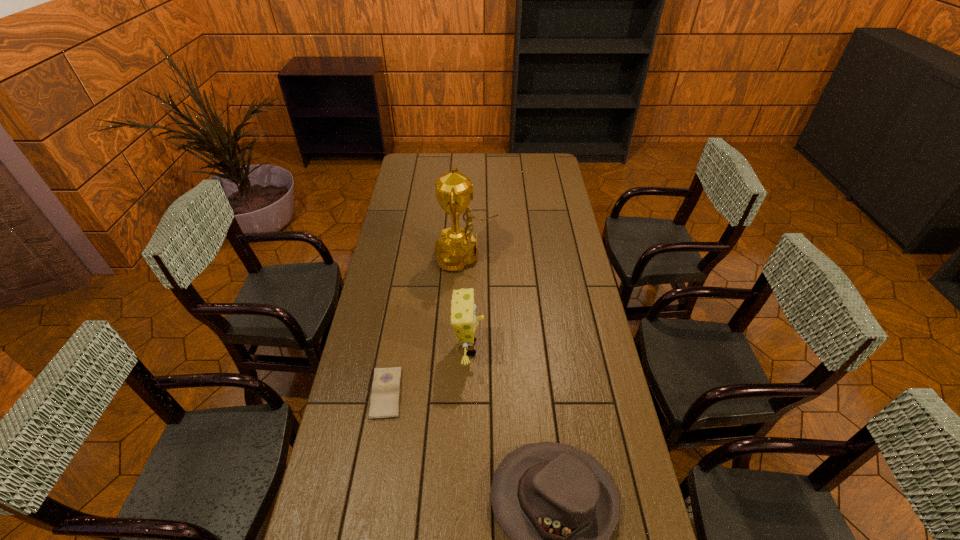
The image size is (960, 540). Identify the location of the tallest object. (457, 248).

In order to click on the farthest object in this screenshot , I will do `click(457, 248)`.

This screenshot has width=960, height=540. Find the location of `the third shortest object`. the third shortest object is located at coordinates (463, 309).

The width and height of the screenshot is (960, 540). What are the coordinates of `the leftmost object` in the screenshot? It's located at (384, 404).

The image size is (960, 540). Identify the location of the shortest object. (384, 404).

In order to click on free space located 0.130m on the front side of the farthest object in this screenshot , I will do `click(528, 256)`.

Image resolution: width=960 pixels, height=540 pixels. I want to click on free space located on the face of the third shortest object, so click(546, 348).

The height and width of the screenshot is (540, 960). I want to click on blank space located on the right of the leftmost object, so click(490, 393).

At what (x,y) coordinates should I click in order to perform the action: click on object that is at the left edge. Please return your answer as a coordinate pair (x, y). Looking at the image, I should click on (384, 404).

Locate an element on the screen. This screenshot has width=960, height=540. free space at the far edge of the desktop is located at coordinates (478, 159).